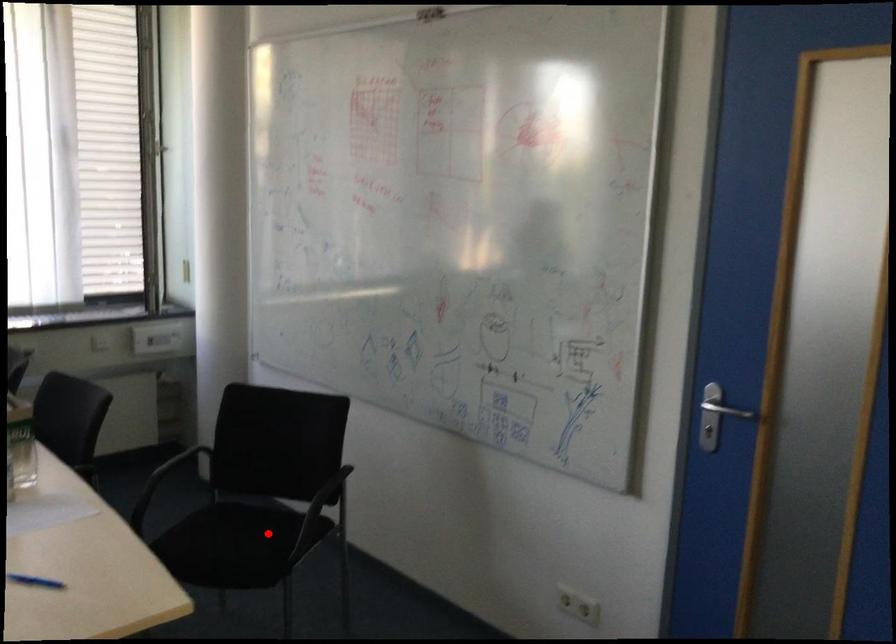
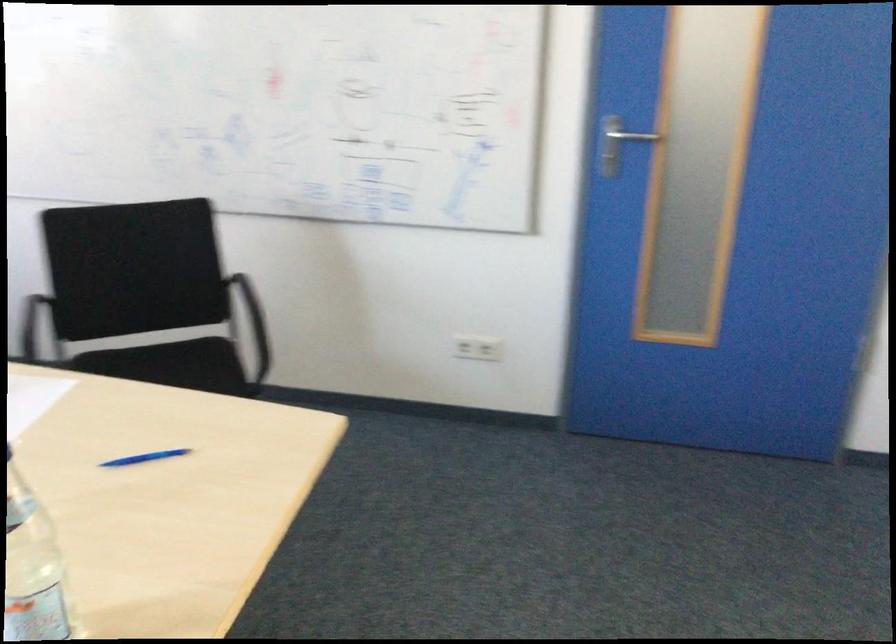
Find the pixel in the second image that matches the highlighted location in the first image.

(194, 364)